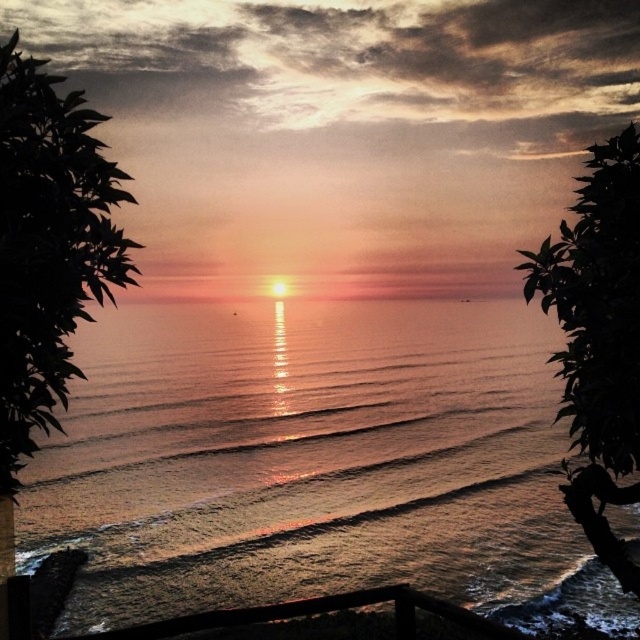
Question: Which of the following is the farthest from the observer?

Choices:
 (A) dark green leafy tree at left
 (B) shiny metallic water at center
 (C) silhouette leafy tree at right

Answer: (B)

Question: Is dark green leafy tree at left bigger than silhouette leafy tree at right?

Choices:
 (A) yes
 (B) no

Answer: (A)

Question: Can you confirm if shiny metallic water at center is thinner than silhouette leafy tree at right?

Choices:
 (A) no
 (B) yes

Answer: (A)

Question: Which point is farther from the camera taking this photo?

Choices:
 (A) (51, 387)
 (B) (593, 403)

Answer: (A)

Question: Is shiny metallic water at center wider than silhouette leafy tree at right?

Choices:
 (A) yes
 (B) no

Answer: (A)

Question: Estimate the real-world distances between objects in this image. Which object is farther from the dark green leafy tree at left?

Choices:
 (A) shiny metallic water at center
 (B) silhouette leafy tree at right

Answer: (A)